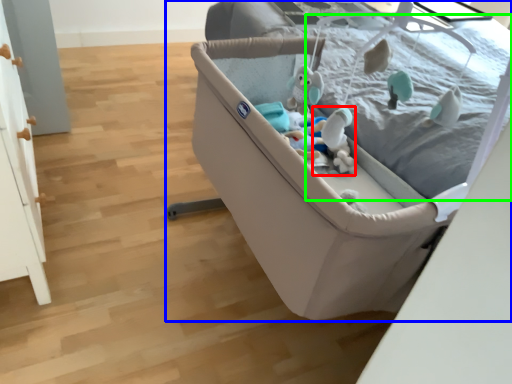
Question: Considering the real-world distances, which object is farthest from toy (highlighted by a red box)? infant bed (highlighted by a blue box) or mattress (highlighted by a green box)?

Choices:
 (A) infant bed
 (B) mattress

Answer: (B)